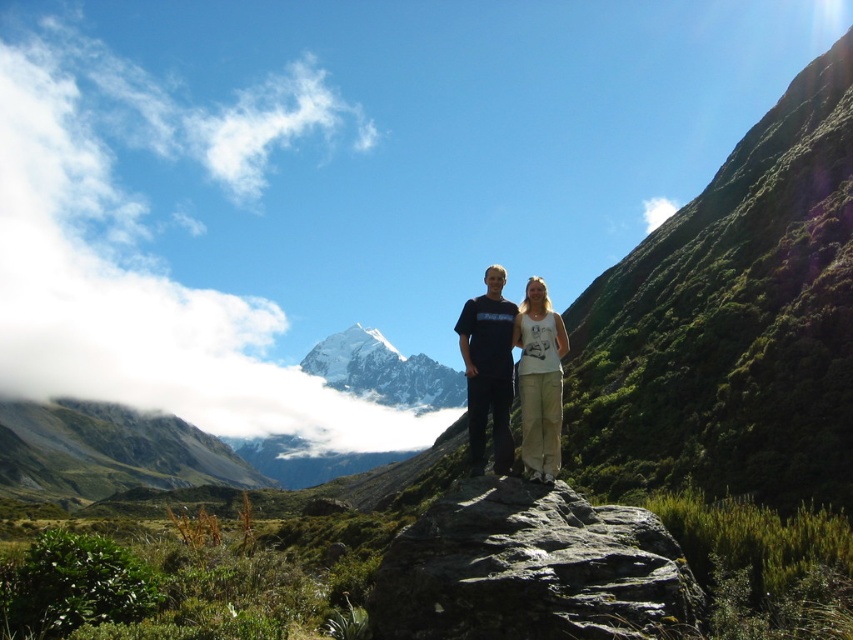
Can you confirm if white fluffy cloud at upper left is positioned above rocky gray mountain at lower left?

Indeed, white fluffy cloud at upper left is positioned over rocky gray mountain at lower left.

Is white fluffy cloud at upper left thinner than rocky gray mountain at lower left?

No, white fluffy cloud at upper left is not thinner than rocky gray mountain at lower left.

The height and width of the screenshot is (640, 853). Identify the location of white fluffy cloud at upper left. (195, 228).

Where is `white fluffy cloud at upper left`? This screenshot has height=640, width=853. white fluffy cloud at upper left is located at coordinates (195, 228).

Is point (468, 609) in front of point (505, 419)?

Yes.

Between point (631, 568) and point (483, 420), which one is positioned behind?

Positioned behind is point (483, 420).

Is point (436, 586) farther from viewer compared to point (498, 289)?

No.

At what (x,y) coordinates should I click in order to perform the action: click on gray rough rock at center. Please return your answer as a coordinate pair (x, y). The height and width of the screenshot is (640, 853). Looking at the image, I should click on 529,568.

Is white fluffy cloud at upper left to the right of gray rough rock at center from the viewer's perspective?

No, white fluffy cloud at upper left is not to the right of gray rough rock at center.

Which is behind, point (190, 369) or point (437, 525)?

The point (190, 369) is behind.

Locate an element on the screen. The image size is (853, 640). white fluffy cloud at upper left is located at coordinates (195, 228).